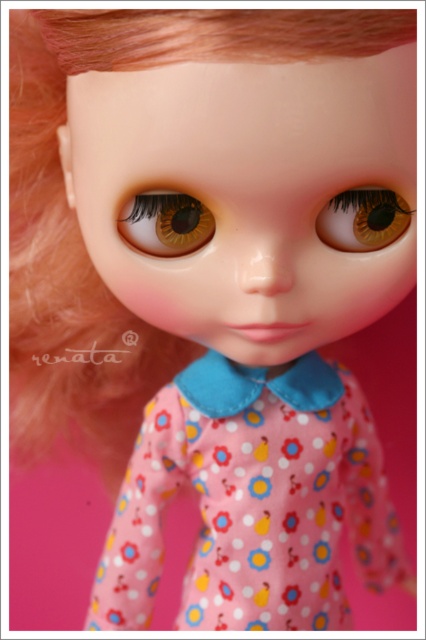
Does pink fabric dress at center have a greater width compared to brown matte eye at center?

Yes.

Which is in front, point (170, 451) or point (157, 221)?

Point (157, 221) is more forward.

Where is `pink fabric dress at center`? pink fabric dress at center is located at coordinates (253, 500).

Is brown matte eye at center further to the viewer compared to brown glossy eye at center?

No.

Between brown matte eye at center and brown glossy eye at center, which one is positioned lower?

brown matte eye at center

The image size is (426, 640). I want to click on brown matte eye at center, so click(x=166, y=224).

Is pink fabric dress at center bigger than brown glossy eye at center?

Indeed, pink fabric dress at center has a larger size compared to brown glossy eye at center.

Is pink fabric dress at center to the right of brown glossy eye at center from the viewer's perspective?

In fact, pink fabric dress at center is to the left of brown glossy eye at center.

Locate an element on the screen. This screenshot has width=426, height=640. pink fabric dress at center is located at coordinates (253, 500).

Locate an element on the screen. pink fabric dress at center is located at coordinates (253, 500).